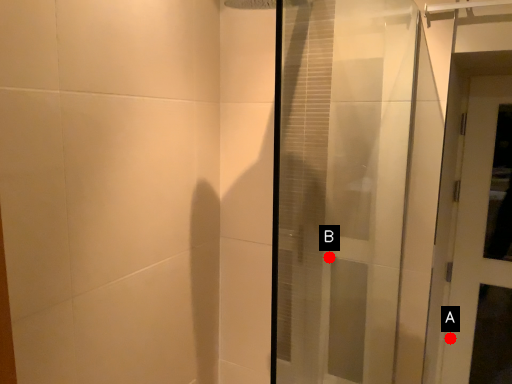
Question: Two points are circled on the image, labeled by A and B beside each circle. Which point is further to the camera?

Choices:
 (A) A is further
 (B) B is further

Answer: (A)